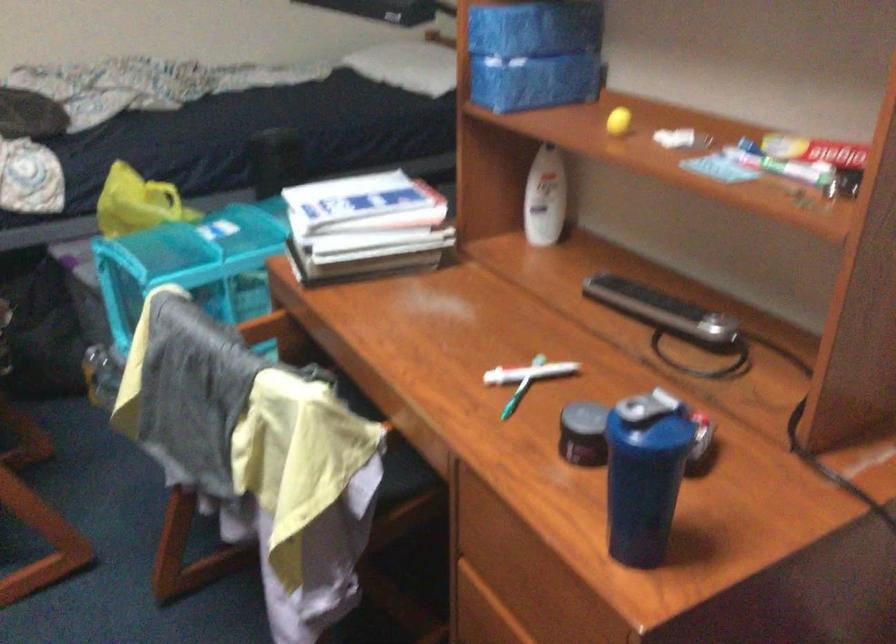
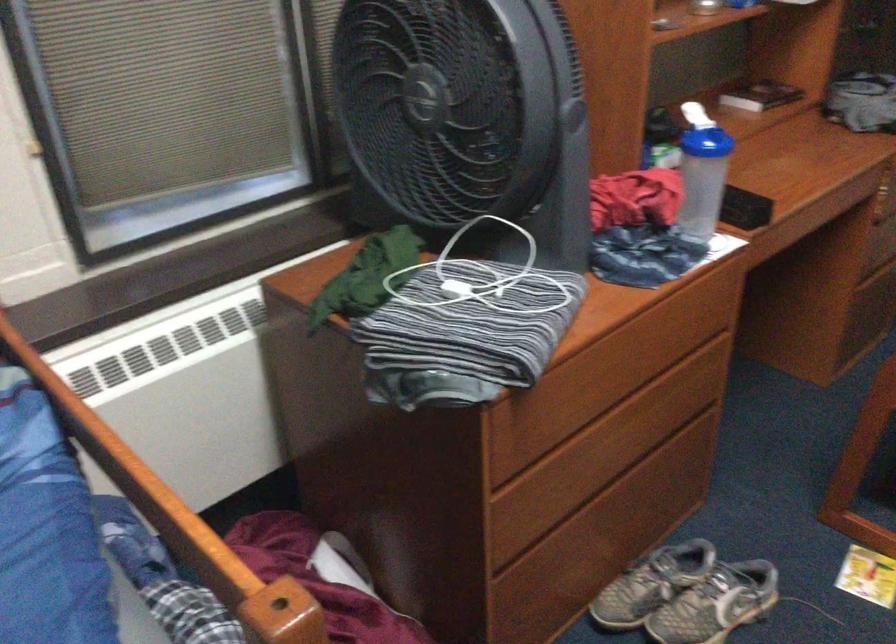
The first image is from the beginning of the video and the second image is from the end. How did the camera likely rotate when shooting the video?

The camera's rotation is toward left-down.